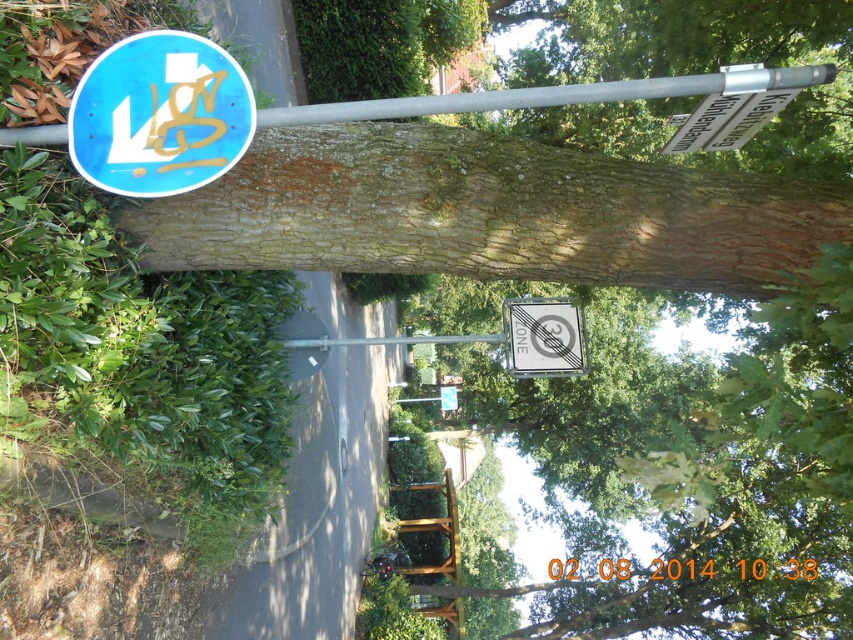
Question: Does silver metallic pole at upper center come behind metallic gray no parking sign at center?

Choices:
 (A) yes
 (B) no

Answer: (B)

Question: Which object is closer to the camera taking this photo?

Choices:
 (A) silver metallic pole at upper center
 (B) blue glossy traffic sign at upper left
 (C) metallic gray no parking sign at center

Answer: (A)

Question: Which of the following is the farthest from the observer?

Choices:
 (A) (560, 298)
 (B) (200, 99)
 (C) (791, 86)

Answer: (A)

Question: Does blue glossy traffic sign at upper left have a lesser width compared to metallic gray no parking sign at center?

Choices:
 (A) yes
 (B) no

Answer: (A)

Question: Estimate the real-world distances between objects in this image. Which object is farther from the metallic gray no parking sign at center?

Choices:
 (A) blue glossy traffic sign at upper left
 (B) silver metallic pole at upper center

Answer: (A)

Question: Observing the image, what is the correct spatial positioning of blue glossy traffic sign at upper left in reference to silver metallic pole at upper center?

Choices:
 (A) left
 (B) right

Answer: (A)